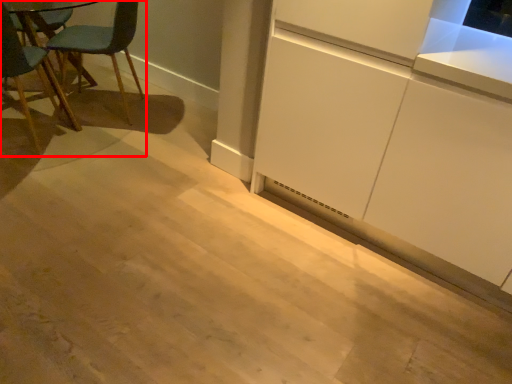
Question: Where is chair (annotated by the red box) located in relation to cabinetry in the image?

Choices:
 (A) left
 (B) right

Answer: (A)